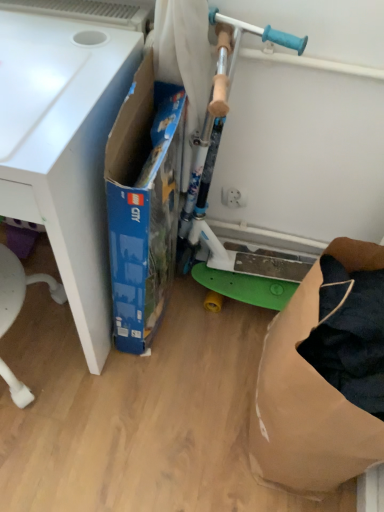
What are the coordinates of `free space between brown paper bag at lower right and blue cardboard box at center` in the screenshot? It's located at (199, 372).